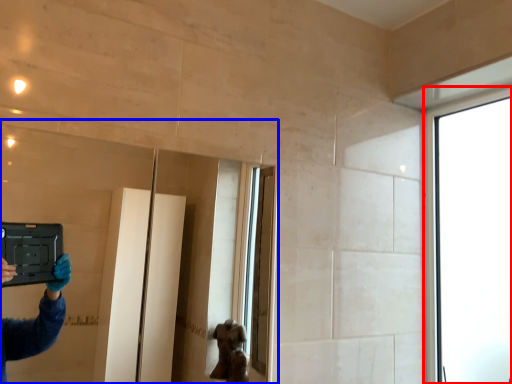
Question: Which of the following is the closest to the observer, window (highlighted by a red box) or mirror (highlighted by a blue box)?

Choices:
 (A) window
 (B) mirror

Answer: (B)